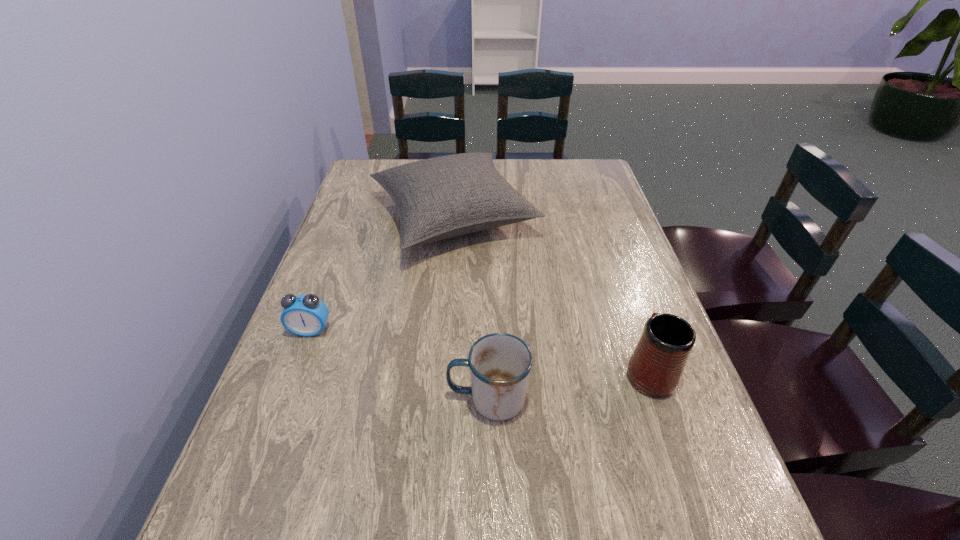
Where is `vacant space in between the right mug and the left mug`? This screenshot has height=540, width=960. vacant space in between the right mug and the left mug is located at coordinates (568, 385).

You are a GUI agent. You are given a task and a screenshot of the screen. Output one action in this format:
    pyautogui.click(x=<x>, y=<y>)
    Task: Click on the vacant area that lies between the cushion and the alarm clock
    
    Given the screenshot: What is the action you would take?
    pyautogui.click(x=382, y=274)

You are a GUI agent. You are given a task and a screenshot of the screen. Output one action in this format:
    pyautogui.click(x=<x>, y=<y>)
    Task: Click on the vacant space that's between the cushion and the rightmost object
    
    Given the screenshot: What is the action you would take?
    pyautogui.click(x=551, y=295)

Locate an element on the screen. This screenshot has height=540, width=960. vacant area between the cushion and the rightmost object is located at coordinates (551, 295).

Where is `unoccupied area between the cushion and the left mug`? unoccupied area between the cushion and the left mug is located at coordinates (470, 309).

Locate an element on the screen. The image size is (960, 540). free space between the second farthest object and the left mug is located at coordinates (399, 364).

Identify the location of free spot between the cushion and the shortest object. This screenshot has width=960, height=540. (382, 274).

Identify the location of vacant area that lies between the left mug and the farthest object. (470, 309).

Locate which object ranks in proximity to the cushion. Please provide its 2D coordinates. Your answer should be formatted as a tuple, i.e. [(x, y)], where the tuple contains the x and y coordinates of a point satisfying the conditions above.

[(305, 315)]

This screenshot has width=960, height=540. Identify the location of object that ranks as the closest to the shortest object. (443, 197).